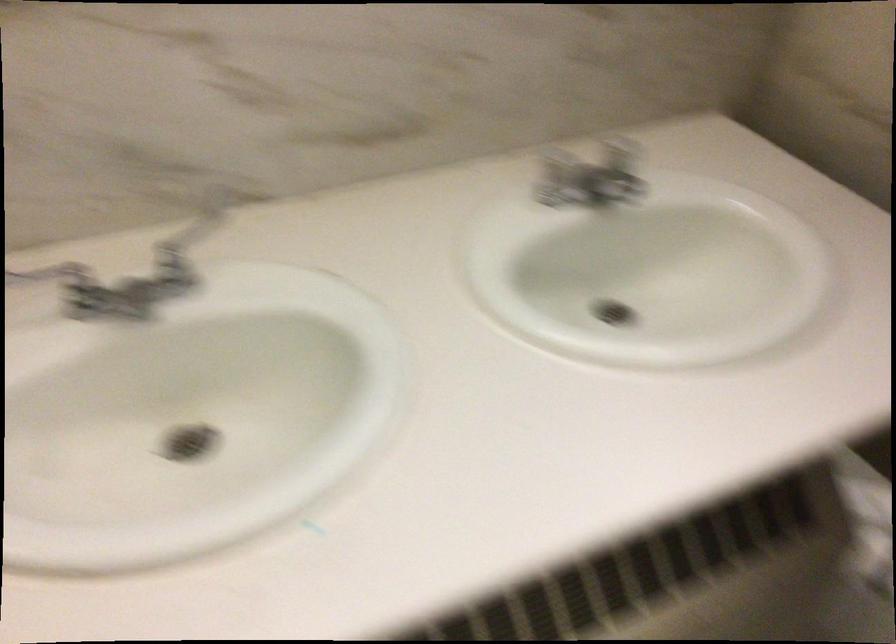
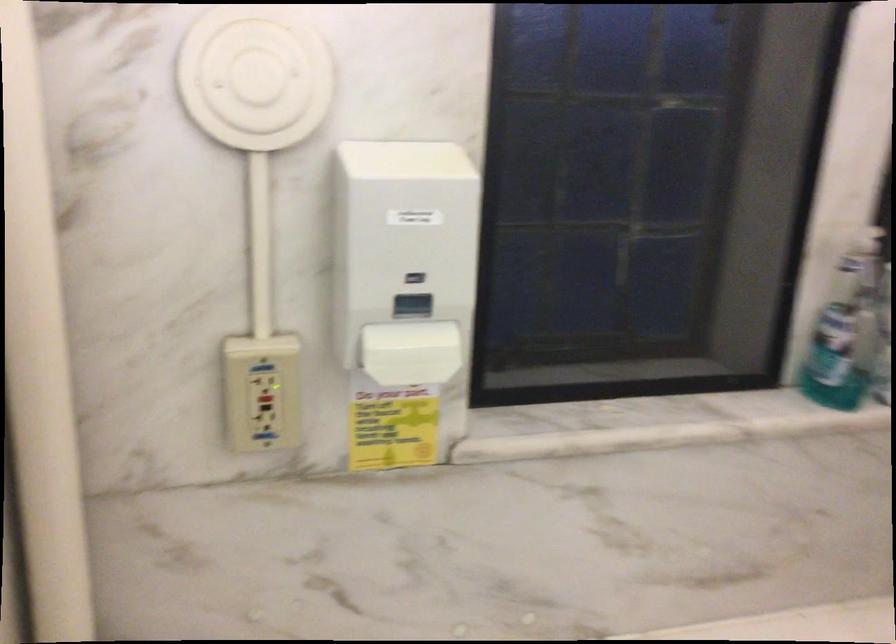
Question: In a continuous first-person perspective shot, in which direction is the camera moving?

Choices:
 (A) Left
 (B) Right
 (C) Forward
 (D) Backward

Answer: (A)